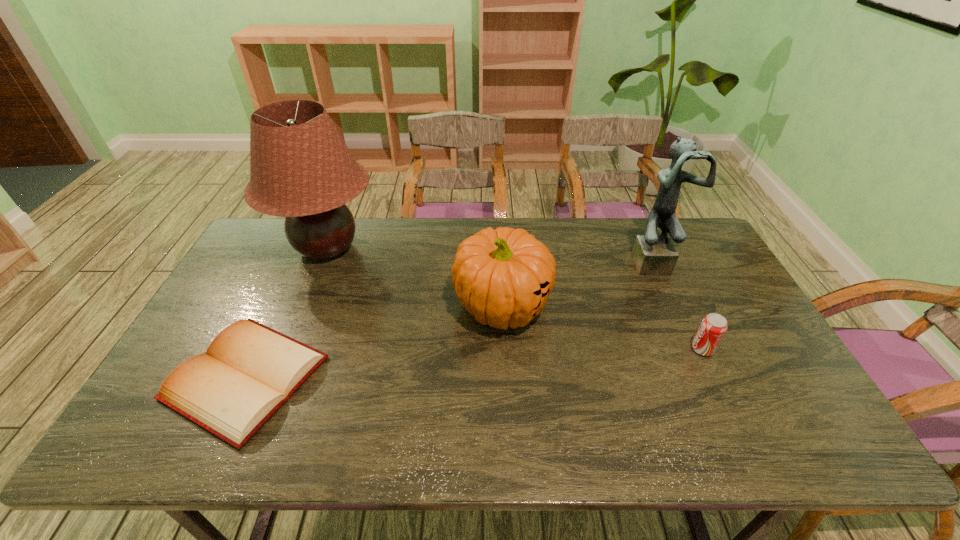
Identify the location of lampshade. (300, 168).

You are a GUI agent. You are given a task and a screenshot of the screen. Output one action in this format:
    pyautogui.click(x=<x>, y=<y>)
    Task: Click on the sculpture
    
    Given the screenshot: What is the action you would take?
    pyautogui.click(x=653, y=254)

Identify the location of pumpkin. The width and height of the screenshot is (960, 540). (503, 277).

Image resolution: width=960 pixels, height=540 pixels. I want to click on the third object from left to right, so click(503, 277).

You are a GUI agent. You are given a task and a screenshot of the screen. Output one action in this format:
    pyautogui.click(x=<x>, y=<y>)
    Task: Click on the soda can
    
    Given the screenshot: What is the action you would take?
    pyautogui.click(x=713, y=326)

Identify the location of the shortest object. The image size is (960, 540). (249, 371).

You are a GUI agent. You are given a task and a screenshot of the screen. Output one action in this format:
    pyautogui.click(x=<x>, y=<y>)
    Task: Click on the free space located 0.060m on the front-facing side of the lampshade
    This screenshot has height=540, width=960.
    Given the screenshot: What is the action you would take?
    pyautogui.click(x=397, y=248)

Where is `vacant region located 0.060m on the face of the sculpture`? The width and height of the screenshot is (960, 540). vacant region located 0.060m on the face of the sculpture is located at coordinates (667, 290).

Find the location of a particular element. The image size is (960, 540). free space located on the surface of the third shortest object is located at coordinates (509, 418).

You are a GUI agent. You are given a task and a screenshot of the screen. Output one action in this format:
    pyautogui.click(x=<x>, y=<y>)
    Task: Click on the vacant space located 0.160m on the logo side of the fourth tallest object
    
    Given the screenshot: What is the action you would take?
    pyautogui.click(x=632, y=349)